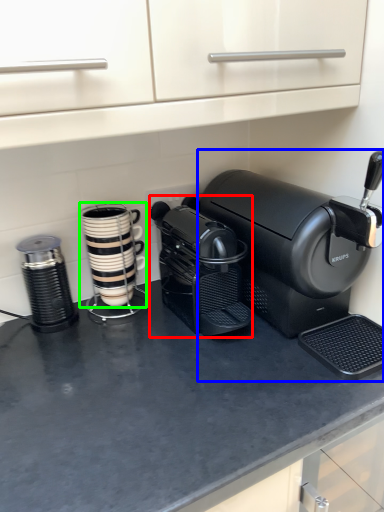
Question: Considering the real-world distances, which object is closest to coffee maker (highlighted by a red box)? coffee maker (highlighted by a blue box) or kitchen appliance (highlighted by a green box).

Choices:
 (A) coffee maker
 (B) kitchen appliance

Answer: (A)